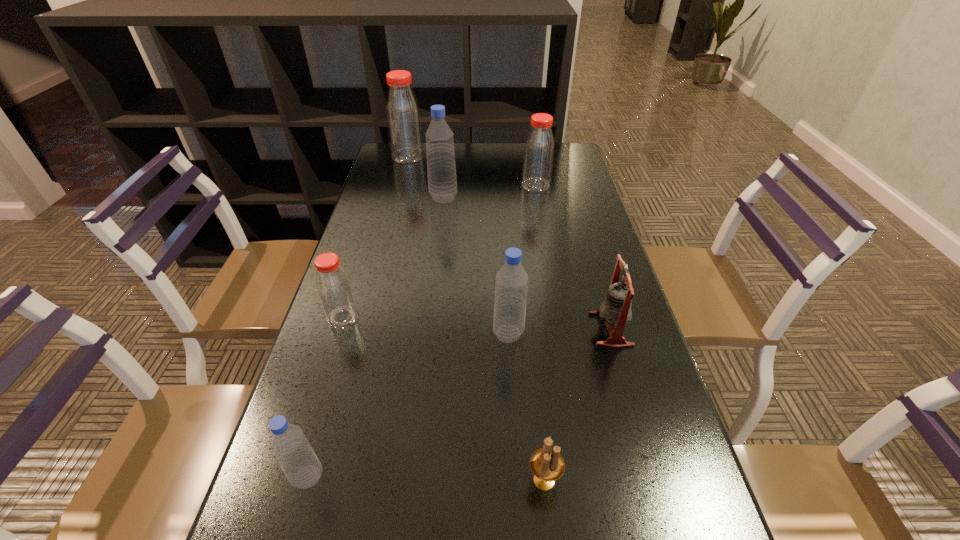
Where is `free space between the nearest blue bottle and the rightmost object`? free space between the nearest blue bottle and the rightmost object is located at coordinates (459, 403).

Find the location of `free space between the second biggest blue bottle and the bell`. free space between the second biggest blue bottle and the bell is located at coordinates (560, 332).

This screenshot has width=960, height=540. I want to click on vacant space that's between the second farthest blue bottle and the nearest red bottle, so click(x=426, y=326).

Find the location of a particular element. free space between the second nearest blue bottle and the nearest bottle is located at coordinates (408, 406).

At what (x,y) coordinates should I click in order to perform the action: click on free spot between the third bottle from right to left and the second smallest blue bottle. Please return your answer as a coordinate pair (x, y). The width and height of the screenshot is (960, 540). Looking at the image, I should click on (476, 266).

You are a GUI agent. You are given a task and a screenshot of the screen. Output one action in this format:
    pyautogui.click(x=<x>, y=<y>)
    Task: Click on the unoccupied area between the bell and the shortest object
    
    Given the screenshot: What is the action you would take?
    pyautogui.click(x=577, y=405)

Where is `free area in between the rightmost object and the farthest bottle`? Image resolution: width=960 pixels, height=540 pixels. free area in between the rightmost object and the farthest bottle is located at coordinates (509, 243).

Point out which object is positioned as the second nearest to the nearest red bottle. Please provide its 2D coordinates. Your answer should be formatted as a tuple, i.e. [(x, y)], where the tuple contains the x and y coordinates of a point satisfying the conditions above.

[(511, 285)]

Where is `object that ranks as the third closest to the nearest blue bottle`? The width and height of the screenshot is (960, 540). object that ranks as the third closest to the nearest blue bottle is located at coordinates pos(511,285).

Identify which bottle is the fourth closest to the leftmost blue bottle. Please provide its 2D coordinates. Your answer should be formatted as a tuple, i.e. [(x, y)], where the tuple contains the x and y coordinates of a point satisfying the conditions above.

[(538, 156)]